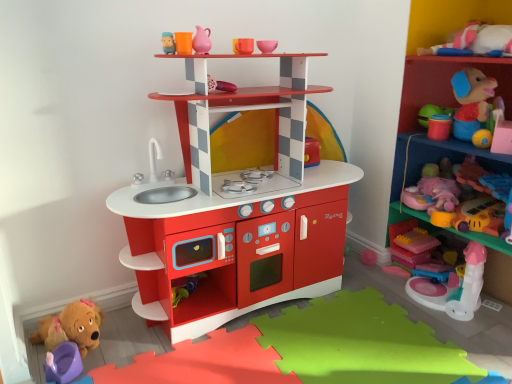
Question: Based on their sizes in the image, would you say matte pink cup at upper center, marked as the fifth toy in a right-to-left arrangement, is bigger or smaller than translucent plastic blocks at lower right, which appears as the 8th toy when viewed from the left?

Choices:
 (A) small
 (B) big

Answer: (A)

Question: Is matte pink cup at upper center, which ranks as the fifth toy in left-to-right order, situated inside translucent plastic blocks at lower right, which ranks as the second toy in right-to-left order, or outside?

Choices:
 (A) inside
 (B) outside

Answer: (B)

Question: Estimate the real-world distances between objects in this image. Which object is farther from the pink plastic unicorn at upper right, which ranks as the seventh toy in left-to-right order?

Choices:
 (A) pink plush toy at right, which ranks as the 9th toy in left-to-right order
 (B) smooth plastic shelf at center, which ranks as the second shelf in right-to-left order
 (C) brown plush dog at lower left, which is the ninth toy in right-to-left order
 (D) pink matte pitcher at upper center, which ranks as the seventh toy in right-to-left order
 (E) matte pink cup at upper center, marked as the fifth toy in a right-to-left arrangement

Answer: (C)

Question: Which object is positioned farthest from the matte pink cup at upper center, marked as the fifth toy in a right-to-left arrangement?

Choices:
 (A) brown plush dog at lower left, acting as the 1th toy starting from the left
 (B) smooth plastic shelf at center, which ranks as the second shelf in right-to-left order
 (C) matte plastic spoon at upper center, which appears as the fourth toy when viewed from the left
 (D) purple plastic potty at lower left, acting as the 2th toy starting from the left
 (E) pink plastic unicorn at upper right, acting as the third toy starting from the right

Answer: (E)